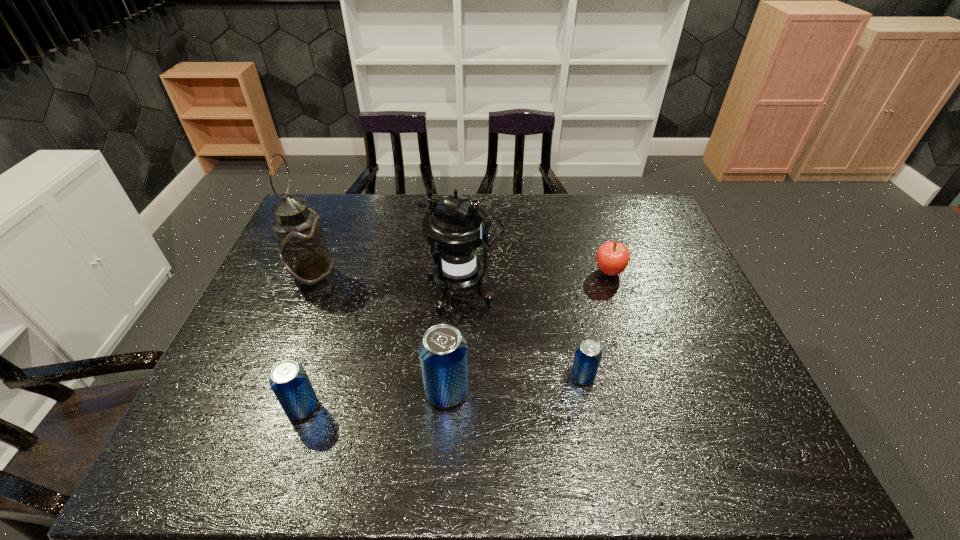
Identify the location of object identified as the third closest to the apple. This screenshot has height=540, width=960. (443, 350).

What are the coordinates of `the closest beer can to the apple` in the screenshot? It's located at (588, 355).

Point out which beer can is positioned as the nearest to the lantern. Please provide its 2D coordinates. Your answer should be formatted as a tuple, i.e. [(x, y)], where the tuple contains the x and y coordinates of a point satisfying the conditions above.

[(443, 350)]

Locate an element on the screen. Image resolution: width=960 pixels, height=540 pixels. vacant space that satisfies the following two spatial constraints: 1. on the front side of the lantern; 2. on the right side of the oil lamp is located at coordinates (308, 293).

The height and width of the screenshot is (540, 960). I want to click on free space in the image that satisfies the following two spatial constraints: 1. on the front side of the fourth tallest object; 2. on the right side of the oil lamp, so click(262, 407).